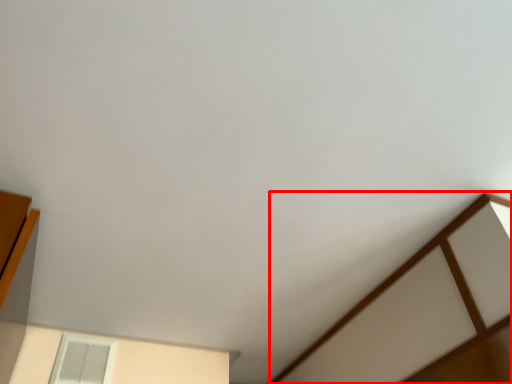
Question: From the image's perspective, where is furniture (annotated by the red box) located in relation to window in the image?

Choices:
 (A) above
 (B) below

Answer: (B)